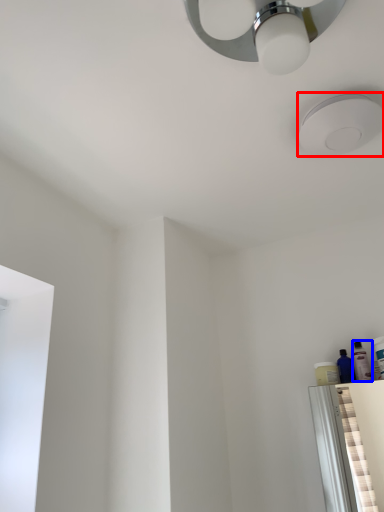
Question: Which object appears farthest to the camera in this image, droplight (highlighted by a red box) or toiletry (highlighted by a blue box)?

Choices:
 (A) droplight
 (B) toiletry

Answer: (B)